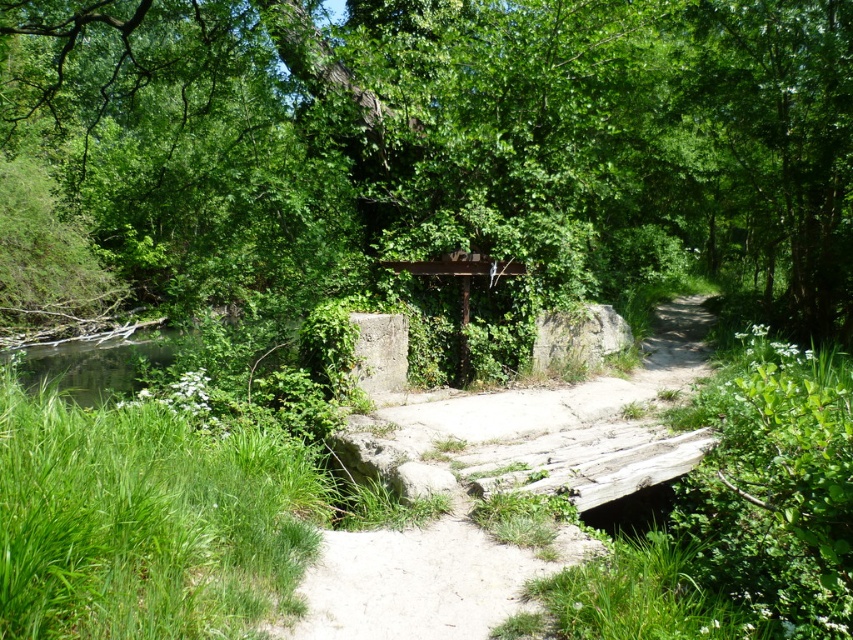
You are standing on the rustic wooden bridge and looking towards the stream. There are two points marked on the bridge deck, one at coordinates point (x=300, y=90) and the other at point (x=496, y=419). Which point is closer to you as you face the stream?

Point (x=300, y=90) is further to the camera than point (x=496, y=419), so the point closer to you would be point (x=496, y=419).